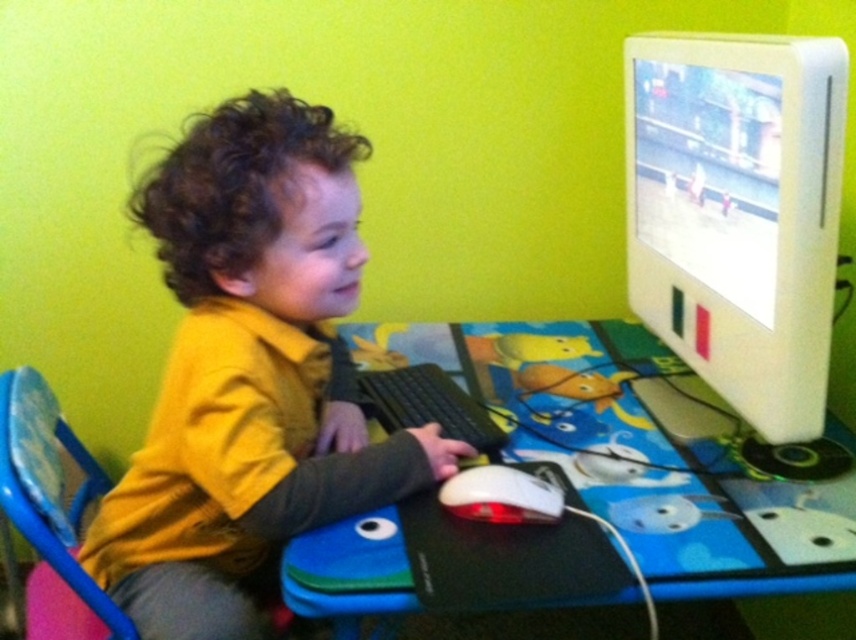
From the picture: Can you confirm if black plastic keyboard at center is smaller than white matte mouse at center?

No.

Is black plastic keyboard at center below white matte mouse at center?

Actually, black plastic keyboard at center is above white matte mouse at center.

This screenshot has width=856, height=640. I want to click on black plastic keyboard at center, so click(428, 404).

Locate an element on the screen. black plastic keyboard at center is located at coordinates (428, 404).

Who is shorter, blue plastic computer desk at center or white matte mouse at center?

white matte mouse at center is shorter.

Which is in front, point (583, 339) or point (480, 486)?

Point (480, 486) is more forward.

You are a GUI agent. You are given a task and a screenshot of the screen. Output one action in this format:
    pyautogui.click(x=<x>, y=<y>)
    Task: Click on the blue plastic computer desk at center
    
    Given the screenshot: What is the action you would take?
    pyautogui.click(x=635, y=456)

Does blue plastic computer desk at center have a lesser height compared to black plastic keyboard at center?

No, blue plastic computer desk at center is not shorter than black plastic keyboard at center.

Is blue plastic computer desk at center below black plastic keyboard at center?

Correct, blue plastic computer desk at center is located below black plastic keyboard at center.

At what (x,y) coordinates should I click in order to perform the action: click on blue plastic computer desk at center. Please return your answer as a coordinate pair (x, y). The width and height of the screenshot is (856, 640). Looking at the image, I should click on (635, 456).